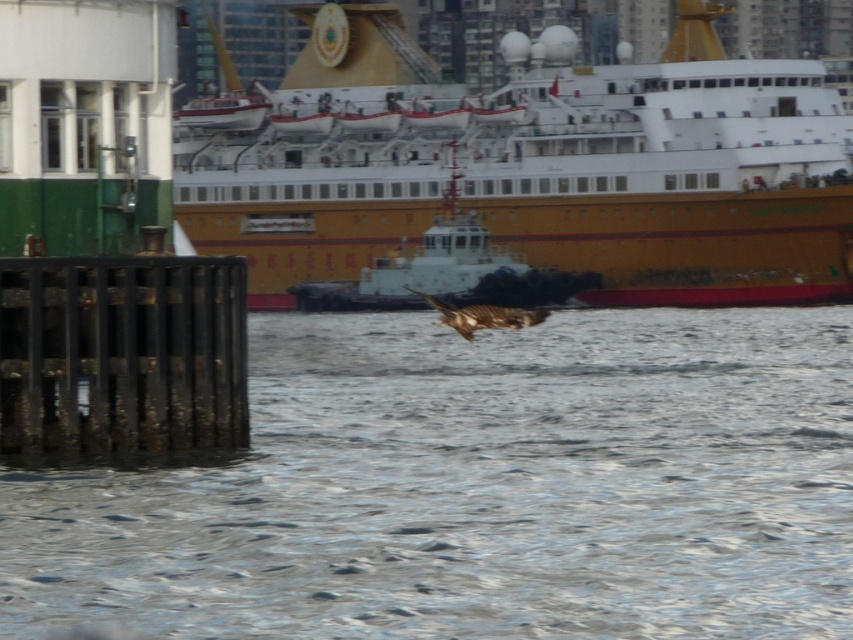
Which of these two, gold/yellow ship at center or brown feathered bird at center, stands taller?

With more height is gold/yellow ship at center.

Who is positioned more to the right, gold/yellow ship at center or brown feathered bird at center?

gold/yellow ship at center

Locate an element on the screen. Image resolution: width=853 pixels, height=640 pixels. gold/yellow ship at center is located at coordinates (535, 168).

Does point (268, 388) come in front of point (822, 93)?

That is True.

From the picture: Does translucent gray water at center lie in front of gold/yellow ship at center?

Yes, translucent gray water at center is in front of gold/yellow ship at center.

Is point (136, 468) closer to camera compared to point (791, 260)?

Yes, point (136, 468) is in front of point (791, 260).

Image resolution: width=853 pixels, height=640 pixels. I want to click on translucent gray water at center, so click(477, 488).

Which is more to the right, translucent gray water at center or brown feathered bird at center?

Positioned to the right is translucent gray water at center.

Between translucent gray water at center and brown feathered bird at center, which one has more height?

translucent gray water at center is taller.

Looking at this image, who is more distant from viewer, (279,534) or (427,300)?

The point (427,300) is more distant.

This screenshot has width=853, height=640. I want to click on translucent gray water at center, so click(477, 488).